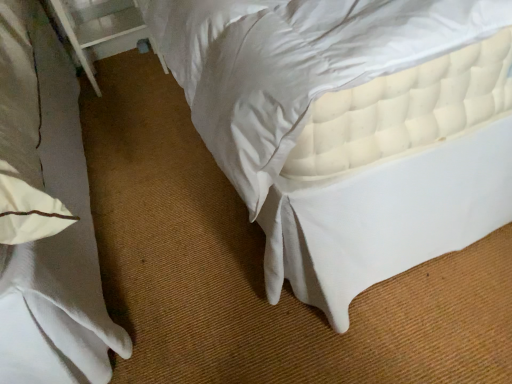
Question: Does white quilted mattress at upper right turn towards white plastic balustrade at upper left?

Choices:
 (A) no
 (B) yes

Answer: (A)

Question: Does white quilted mattress at upper right have a lesser width compared to white plastic balustrade at upper left?

Choices:
 (A) yes
 (B) no

Answer: (B)

Question: Are white quilted mattress at upper right and white plastic balustrade at upper left far apart?

Choices:
 (A) no
 (B) yes

Answer: (B)

Question: From a real-world perspective, is white quilted mattress at upper right beneath white plastic balustrade at upper left?

Choices:
 (A) no
 (B) yes

Answer: (B)

Question: Is white quilted mattress at upper right shorter than white plastic balustrade at upper left?

Choices:
 (A) no
 (B) yes

Answer: (B)

Question: Can you confirm if white quilted mattress at upper right is taller than white plastic balustrade at upper left?

Choices:
 (A) yes
 (B) no

Answer: (B)

Question: Considering the relative sizes of white plastic balustrade at upper left and white quilted mattress at upper right in the image provided, is white plastic balustrade at upper left shorter than white quilted mattress at upper right?

Choices:
 (A) yes
 (B) no

Answer: (B)

Question: Could you tell me if white plastic balustrade at upper left is turned towards white quilted mattress at upper right?

Choices:
 (A) yes
 (B) no

Answer: (B)

Question: From a real-world perspective, is white plastic balustrade at upper left physically above white quilted mattress at upper right?

Choices:
 (A) yes
 (B) no

Answer: (A)

Question: Is white plastic balustrade at upper left oriented away from white quilted mattress at upper right?

Choices:
 (A) yes
 (B) no

Answer: (B)

Question: Is the depth of white plastic balustrade at upper left less than that of white quilted mattress at upper right?

Choices:
 (A) yes
 (B) no

Answer: (B)

Question: Is white plastic balustrade at upper left located outside white quilted mattress at upper right?

Choices:
 (A) no
 (B) yes

Answer: (B)

Question: From a real-world perspective, is white quilted mattress at upper right positioned above or below white plastic balustrade at upper left?

Choices:
 (A) below
 (B) above

Answer: (A)